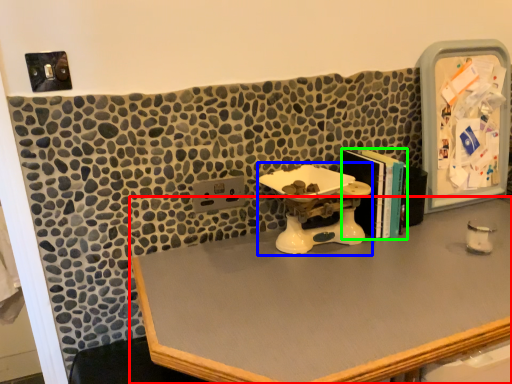
Question: Estimate the real-world distances between objects in this image. Which object is closer to desk (highlighted by a red box), sink (highlighted by a blue box) or book (highlighted by a green box)?

Choices:
 (A) sink
 (B) book

Answer: (A)